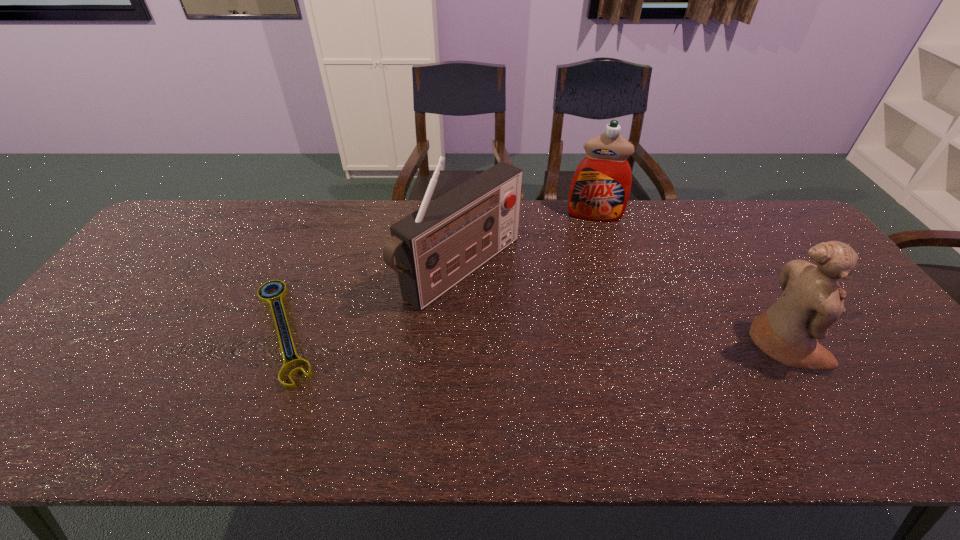
This screenshot has height=540, width=960. I want to click on object that stands as the second closest to the third object from right to left, so click(600, 188).

Identify the location of blank area in the image that satisfies the following two spatial constraints: 1. on the front side of the rightmost object; 2. on the front-facing side of the leftmost object. The image size is (960, 540). (277, 346).

Image resolution: width=960 pixels, height=540 pixels. Find the location of `vacant position in the image that satisfies the following two spatial constraints: 1. on the back side of the farthest object; 2. on the right side of the leftmost object`. vacant position in the image that satisfies the following two spatial constraints: 1. on the back side of the farthest object; 2. on the right side of the leftmost object is located at coordinates (331, 215).

Image resolution: width=960 pixels, height=540 pixels. Identify the location of free point that satisfies the following two spatial constraints: 1. on the front side of the wrench; 2. on the front-facing side of the rightmost object. (277, 346).

At what (x,y) coordinates should I click in order to perform the action: click on vacant space that satisfies the following two spatial constraints: 1. on the front side of the third object from right to left; 2. on the front-facing side of the figurine. Please return your answer as a coordinate pair (x, y). This screenshot has width=960, height=540. Looking at the image, I should click on (457, 346).

The width and height of the screenshot is (960, 540). What are the coordinates of `vacant space that satisfies the following two spatial constraints: 1. on the back side of the second object from left to right; 2. on the right side of the third object from left to right` in the screenshot? It's located at (464, 215).